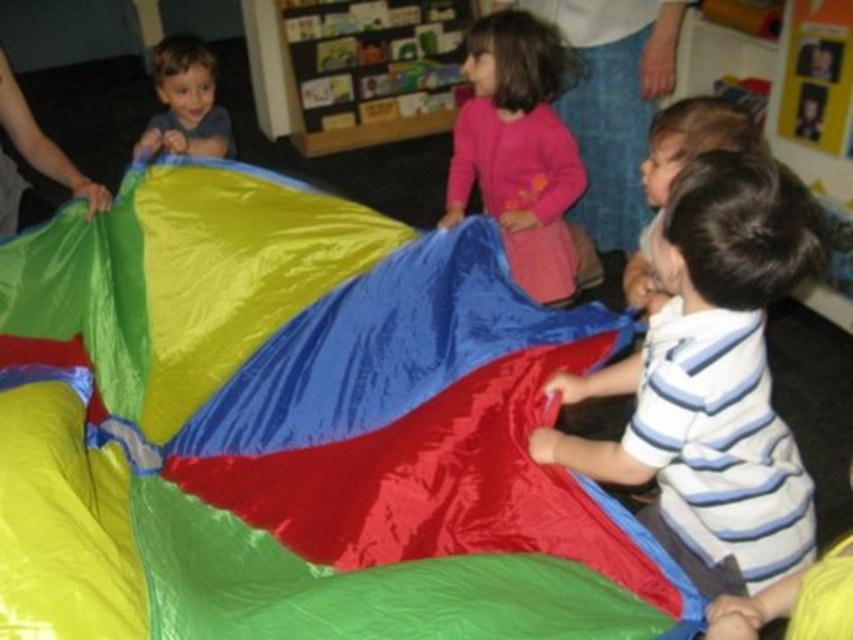
Question: Does striped cotton shirt at lower right appear over pink fabric at center?

Choices:
 (A) no
 (B) yes

Answer: (A)

Question: Which object is closer to the camera taking this photo?

Choices:
 (A) matte blue shirt at upper left
 (B) shiny plastic kite at center
 (C) striped cotton shirt at lower right
 (D) pink fabric at center

Answer: (B)

Question: Does shiny plastic kite at center have a larger size compared to matte blue shirt at upper left?

Choices:
 (A) yes
 (B) no

Answer: (A)

Question: Which point is farther to the camera?

Choices:
 (A) (476, 120)
 (B) (216, 138)
 (C) (779, 179)

Answer: (B)

Question: Considering the real-world distances, which object is closest to the striped cotton shirt at lower right?

Choices:
 (A) pink fabric at center
 (B) matte blue shirt at upper left
 (C) shiny plastic kite at center

Answer: (C)

Question: Can you confirm if pink fabric at center is positioned to the left of matte blue shirt at upper left?

Choices:
 (A) yes
 (B) no

Answer: (B)